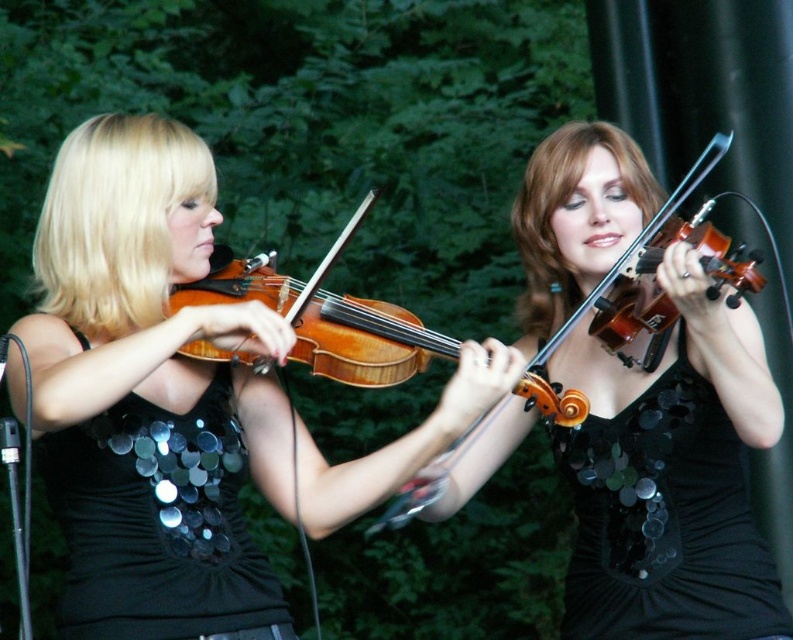
Based on the photo, can you confirm if black sequined dress at center is taller than black sequined dress at left?

Yes.

Between black sequined dress at center and black sequined dress at left, which one has less height?

black sequined dress at left is shorter.

Where is `black sequined dress at center`? black sequined dress at center is located at coordinates (665, 522).

Which is more to the right, black sequined dress at center or wooden violin at center?

black sequined dress at center is more to the right.

Does black sequined dress at center have a larger size compared to wooden violin at center?

No.

Find the location of a particular element. This screenshot has width=793, height=640. black sequined dress at center is located at coordinates (665, 522).

Is shiny sequined top at center positioned in front of wooden violin at center?

Yes.

Is point (117, 289) positioned in front of point (334, 244)?

That is False.

Identify the location of shiny sequined top at center. (148, 394).